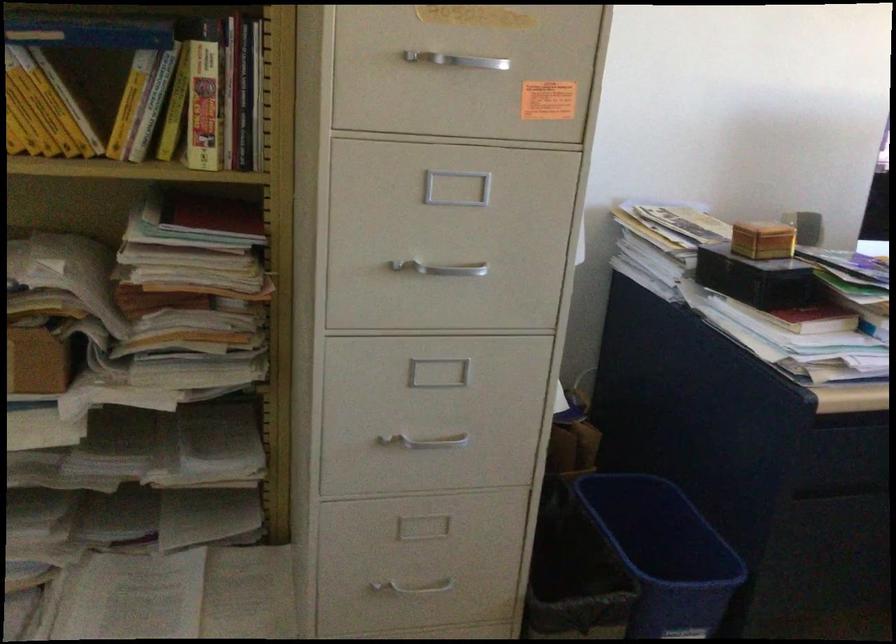
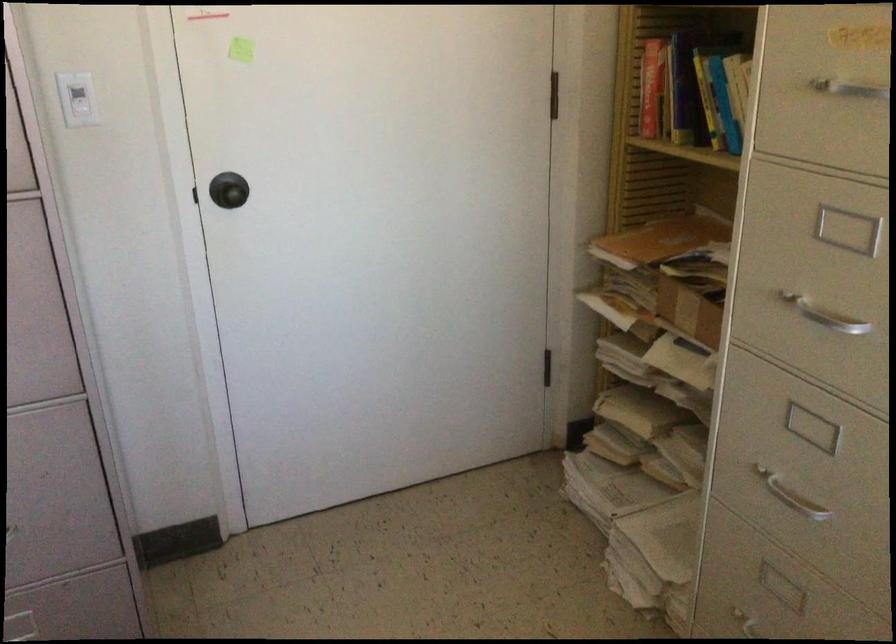
Where in the second image is the point corresponding to [403,571] from the first image?

(754, 625)